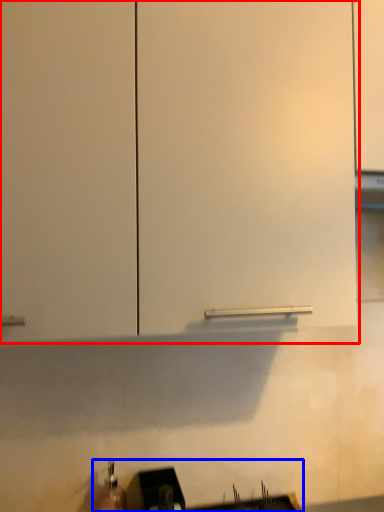
Question: Which point is closer to the camera, cabinetry (highlighted by a red box) or sink (highlighted by a blue box)?

Choices:
 (A) cabinetry
 (B) sink

Answer: (A)